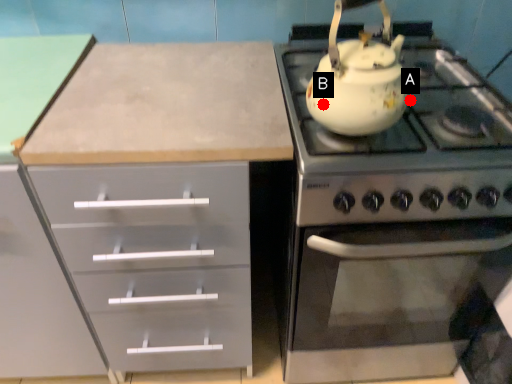
Question: Two points are circled on the image, labeled by A and B beside each circle. Which point is further to the camera?

Choices:
 (A) A is further
 (B) B is further

Answer: (A)